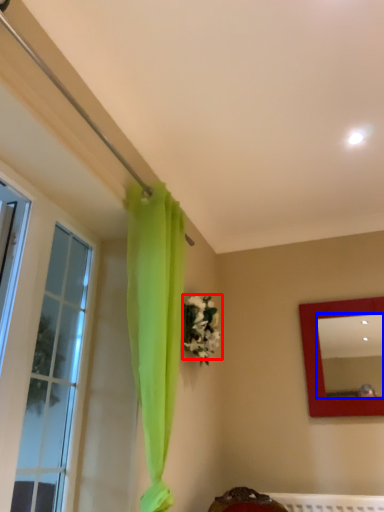
Question: Which object is further to the camera taking this photo, flower (highlighted by a red box) or mirror (highlighted by a blue box)?

Choices:
 (A) flower
 (B) mirror

Answer: (B)